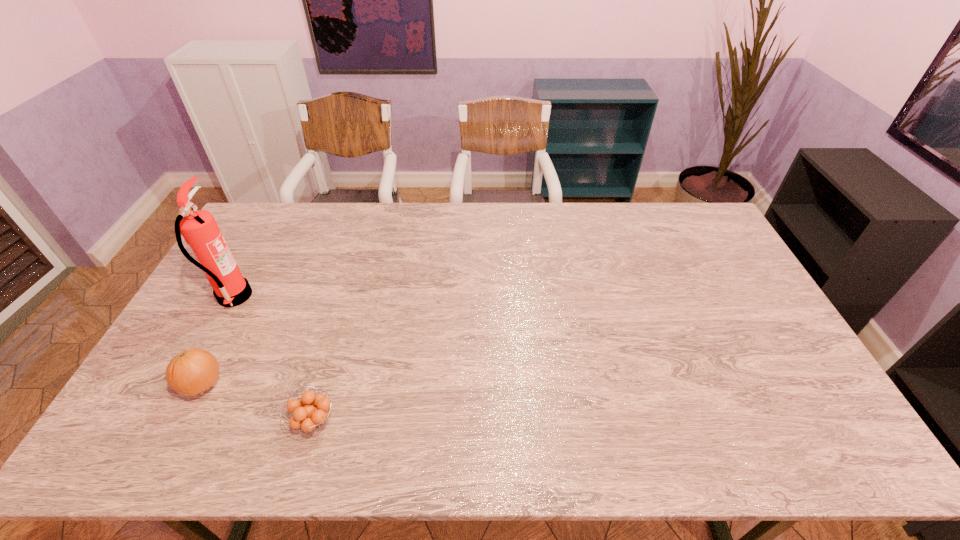
You are a GUI agent. You are given a task and a screenshot of the screen. Output one action in this format:
    pyautogui.click(x=<x>, y=<y>)
    Task: Click on the fire extinguisher located at the left edge
    
    Given the screenshot: What is the action you would take?
    pyautogui.click(x=199, y=229)

The width and height of the screenshot is (960, 540). Find the location of `orange at the left edge`. orange at the left edge is located at coordinates (191, 372).

What are the coordinates of `vacant point at the far edge` in the screenshot? It's located at (578, 227).

Identify the location of free point at the near edge. pos(599,433).

This screenshot has height=540, width=960. Find the location of `blank space at the left edge`. blank space at the left edge is located at coordinates (196, 326).

Where is `vacant space at the right edge`? vacant space at the right edge is located at coordinates (717, 262).

Where is `blank space at the far left corner of the desktop`? blank space at the far left corner of the desktop is located at coordinates (278, 240).

In the image, there is a desktop. Identify the location of free space at the far right corner. (695, 207).

Where is `blank region between the right orange fruit and the tallest object`? The image size is (960, 540). blank region between the right orange fruit and the tallest object is located at coordinates (274, 359).

The height and width of the screenshot is (540, 960). In order to click on free spot between the shortest object and the second shortest object in this screenshot , I will do `click(258, 403)`.